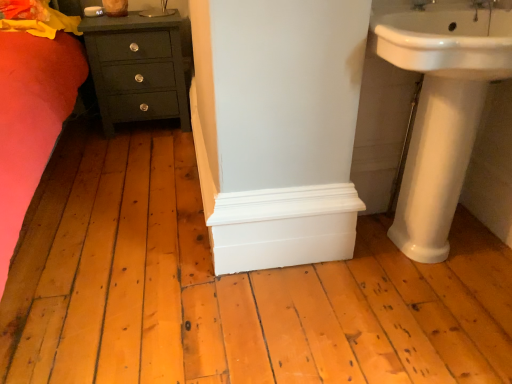
Question: Can you confirm if white glossy sink at upper right, which ranks as the first sink in top-to-bottom order, is taller than white ceramic tap at upper right?

Choices:
 (A) no
 (B) yes

Answer: (B)

Question: Is white glossy sink at upper right, which ranks as the first sink in top-to-bottom order, wider than white ceramic tap at upper right?

Choices:
 (A) no
 (B) yes

Answer: (B)

Question: From a real-world perspective, is white glossy sink at upper right, which ranks as the first sink in top-to-bottom order, positioned over white ceramic tap at upper right based on gravity?

Choices:
 (A) yes
 (B) no

Answer: (B)

Question: Is white glossy sink at upper right, which ranks as the 2th sink in bottom-to-top order, aimed at white ceramic tap at upper right?

Choices:
 (A) yes
 (B) no

Answer: (B)

Question: From the image's perspective, would you say white glossy sink at upper right, which ranks as the first sink in top-to-bottom order, is positioned over white ceramic tap at upper right?

Choices:
 (A) yes
 (B) no

Answer: (B)

Question: Is white glossy sink at upper right, which ranks as the first sink in top-to-bottom order, positioned behind white ceramic tap at upper right?

Choices:
 (A) yes
 (B) no

Answer: (B)

Question: Is white glossy sink at upper right, which ranks as the 2th sink in bottom-to-top order, with white glossy pedestal sink at right, which ranks as the first sink in bottom-to-top order?

Choices:
 (A) yes
 (B) no

Answer: (B)

Question: Can you confirm if white glossy sink at upper right, which ranks as the 2th sink in bottom-to-top order, is shorter than white glossy pedestal sink at right, which is the second sink in top-to-bottom order?

Choices:
 (A) no
 (B) yes

Answer: (B)

Question: Is white glossy sink at upper right, which ranks as the 2th sink in bottom-to-top order, facing towards white glossy pedestal sink at right, which ranks as the first sink in bottom-to-top order?

Choices:
 (A) yes
 (B) no

Answer: (B)

Question: Is white glossy sink at upper right, which ranks as the 2th sink in bottom-to-top order, behind white glossy pedestal sink at right, which ranks as the first sink in bottom-to-top order?

Choices:
 (A) no
 (B) yes

Answer: (A)

Question: Is white glossy pedestal sink at right, which ranks as the first sink in bottom-to-top order, at the back of white glossy sink at upper right, which ranks as the 2th sink in bottom-to-top order?

Choices:
 (A) no
 (B) yes

Answer: (A)

Question: Is white glossy sink at upper right, which ranks as the first sink in top-to-bottom order, bigger than white glossy pedestal sink at right, which is the second sink in top-to-bottom order?

Choices:
 (A) yes
 (B) no

Answer: (A)

Question: From a real-world perspective, is white glossy sink at upper right, which ranks as the first sink in top-to-bottom order, located beneath matte dark green chest of drawers at lower left?

Choices:
 (A) yes
 (B) no

Answer: (B)